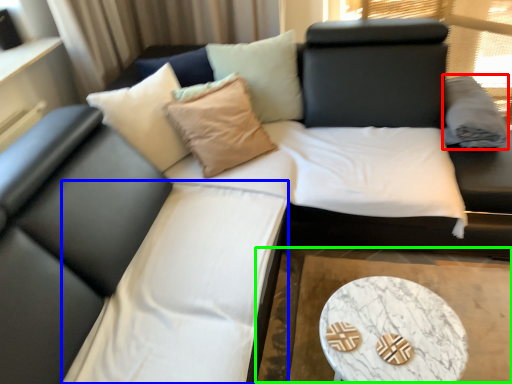
Question: Based on their relative distances, which object is nearer to pillow (highlighted by a red box)? Choose from bedding (highlighted by a blue box) and cocktail table (highlighted by a green box).

Choices:
 (A) bedding
 (B) cocktail table

Answer: (B)